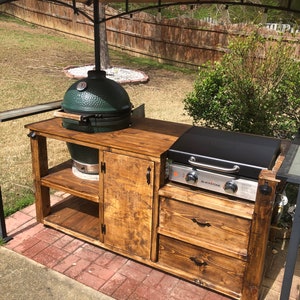
Locate an element on the screen. This screenshot has height=300, width=300. handles is located at coordinates (219, 171), (72, 115), (200, 262), (199, 223), (151, 173).